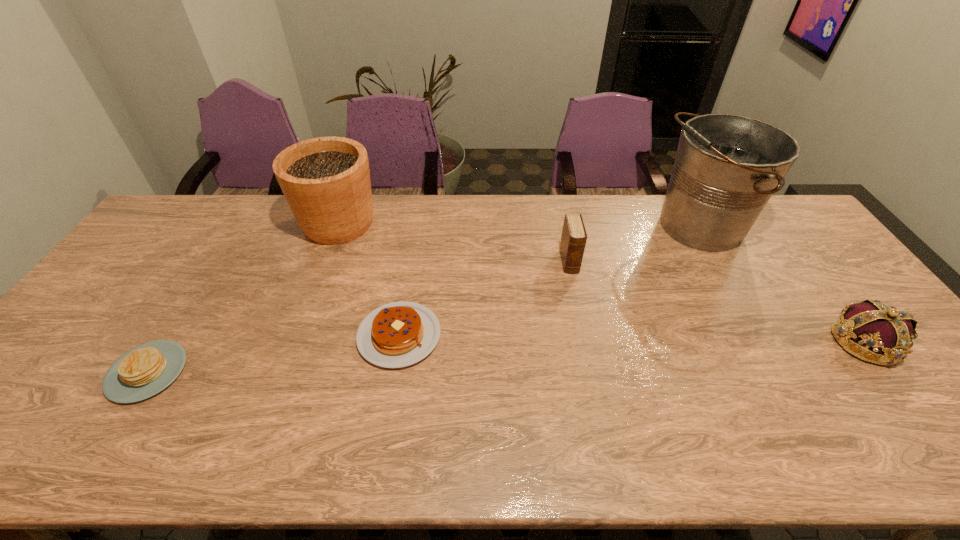
Where is `the fourth closest object to the second tallest object`? The image size is (960, 540). the fourth closest object to the second tallest object is located at coordinates [x=727, y=166].

Locate which object is the fifth closest to the right pancake. Please provide its 2D coordinates. Your answer should be formatted as a tuple, i.e. [(x, y)], where the tuple contains the x and y coordinates of a point satisfying the conditions above.

[(884, 334)]